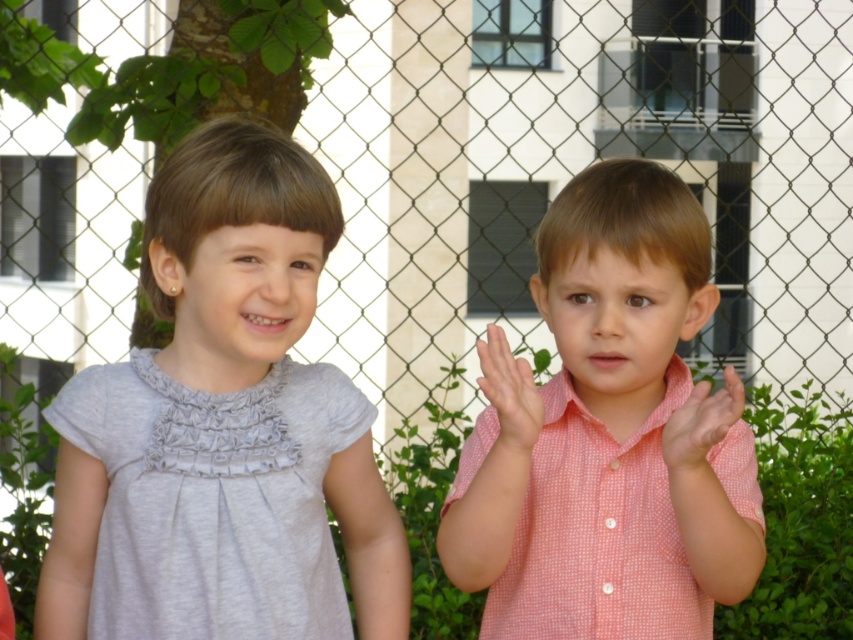
You are a photographer trying to capture a photo of the two children. The camera you are using has a minimum focusing distance of 24 inches. Based on the scene, will you be able to take a clear photo of both the gray matte dress at left and the pink checkered shirt at right without moving the camera?

The distance between the gray matte dress at left and the pink checkered shirt at right is 22.03 inches, which is less than the camera minimum focusing distance of 24 inches. Therefore, the camera may not be able to focus properly on both subjects simultaneously, resulting in a blurry photo.

You are a photographer trying to capture a photo of both children in the image. You notice two points marked in the scene. The first point is at coordinates point (x=672, y=493) and the second is at point (x=724, y=429). To ensure both children are in focus, you need to know which point is closer to the camera. Which point should you focus on?

Point (x=724, y=429) is closer to the camera than point (x=672, y=493) because the objects description states that point (x=672, y=493) is behind point (x=724, y=429).

You are a photographer taking a picture of two children standing in front of a fence. You notice the pink checkered shirt at center and the pink dotted shirt at center. Which child should you ask to stand on a stool to ensure both shirts are at the same height in the photo?

The pink dotted shirt at center is shorter than the pink checkered shirt at center, so you should ask the child wearing the pink dotted shirt at center to stand on a stool to match their heights.